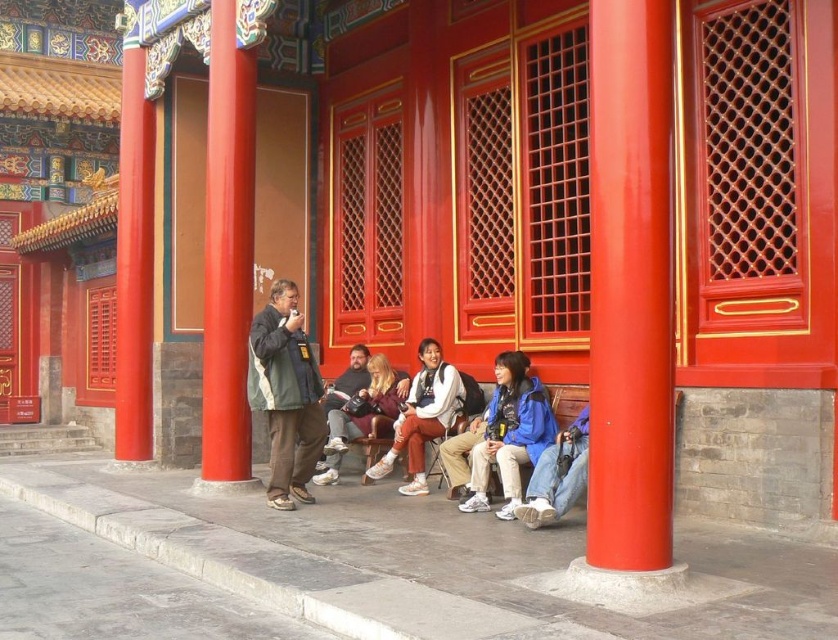
Question: Is smooth glossy red pillar at center positioned in front of smooth red pillar at upper left?

Choices:
 (A) yes
 (B) no

Answer: (A)

Question: Estimate the real-world distances between objects in this image. Which object is closer to the smooth red pillar at upper left?

Choices:
 (A) blue denim jeans at lower right
 (B) white leather sneakers at center

Answer: (B)

Question: Which of these objects is positioned closest to the blue fabric jacket at center?

Choices:
 (A) smooth red pillar at upper left
 (B) white leather sneakers at center

Answer: (B)

Question: Which point is closer to the camera?

Choices:
 (A) (402, 444)
 (B) (286, 497)

Answer: (B)

Question: Can you confirm if smooth red pillar at upper left is smaller than blue denim jeans at lower right?

Choices:
 (A) no
 (B) yes

Answer: (A)

Question: Does smooth red pillar at upper left have a greater width compared to blue denim jeans at lower right?

Choices:
 (A) yes
 (B) no

Answer: (A)